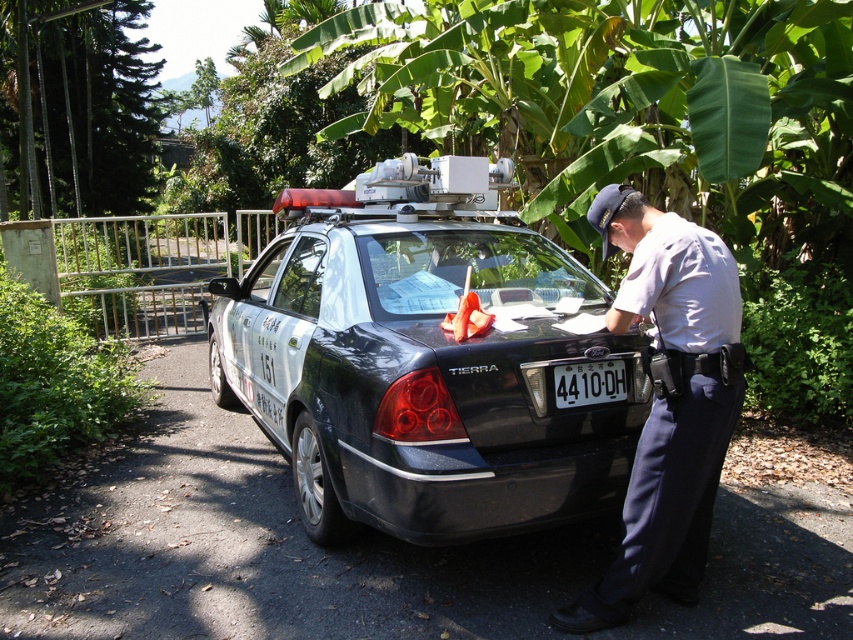
From the picture: Can you confirm if white uniform at center is bigger than white plastic license plate at center?

Correct, white uniform at center is larger in size than white plastic license plate at center.

Is white uniform at center positioned behind white plastic license plate at center?

No, white uniform at center is in front of white plastic license plate at center.

The height and width of the screenshot is (640, 853). What do you see at coordinates (668, 403) in the screenshot? I see `white uniform at center` at bounding box center [668, 403].

I want to click on white uniform at center, so click(668, 403).

Where is `green leafy banana tree at upper center`? The width and height of the screenshot is (853, 640). green leafy banana tree at upper center is located at coordinates (625, 104).

Is point (457, 147) more distant than point (564, 376)?

Yes, point (457, 147) is behind point (564, 376).

Image resolution: width=853 pixels, height=640 pixels. I want to click on green leafy banana tree at upper center, so click(x=625, y=104).

Based on the photo, does green leafy banana tree at upper center appear on the left side of white uniform at center?

No, green leafy banana tree at upper center is not to the left of white uniform at center.

Is green leafy banana tree at upper center thinner than white uniform at center?

Yes, green leafy banana tree at upper center is thinner than white uniform at center.

In order to click on green leafy banana tree at upper center in this screenshot , I will do `click(625, 104)`.